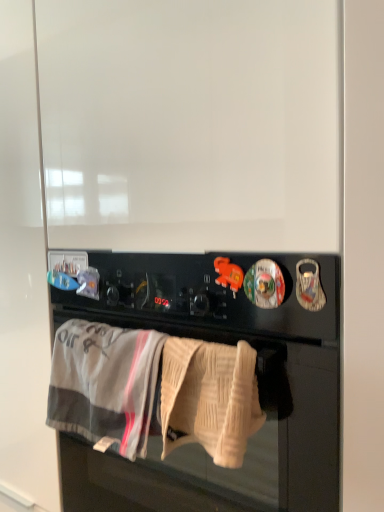
This screenshot has height=512, width=384. What do you see at coordinates (255, 374) in the screenshot?
I see `black matte oven at center` at bounding box center [255, 374].

From the picture: What is the approximate height of gray cotton bath towel at lower center, which is the 2th bath towel from right to left?

8.87 inches.

Locate an element on the screen. black matte oven at center is located at coordinates (255, 374).

From their relative heights in the image, would you say gray cotton bath towel at lower center, which is the 2th bath towel from right to left, is taller or shorter than black matte oven at center?

Clearly, gray cotton bath towel at lower center, which is the 2th bath towel from right to left, is shorter compared to black matte oven at center.

Is gray cotton bath towel at lower center, positioned as the first bath towel in left-to-right order, positioned far away from black matte oven at center?

No, gray cotton bath towel at lower center, positioned as the first bath towel in left-to-right order, is not far from black matte oven at center.

Between point (114, 381) and point (328, 493), which one is positioned behind?

The point (114, 381) is farther.

From the image's perspective, is gray cotton bath towel at lower center, positioned as the first bath towel in left-to-right order, located above or below black matte oven at center?

From the image's perspective, gray cotton bath towel at lower center, positioned as the first bath towel in left-to-right order, appears above black matte oven at center.

Considering the positions of objects beige knitted towel at lower center, marked as the first bath towel in a right-to-left arrangement, and black matte oven at center in the image provided, who is more to the left, beige knitted towel at lower center, marked as the first bath towel in a right-to-left arrangement, or black matte oven at center?

beige knitted towel at lower center, marked as the first bath towel in a right-to-left arrangement, is more to the left.

Is beige knitted towel at lower center, which is the 2th bath towel from left to right, wider or thinner than black matte oven at center?

Clearly, beige knitted towel at lower center, which is the 2th bath towel from left to right, has less width compared to black matte oven at center.

Is beige knitted towel at lower center, marked as the first bath towel in a right-to-left arrangement, aimed at black matte oven at center?

No, beige knitted towel at lower center, marked as the first bath towel in a right-to-left arrangement, is not aimed at black matte oven at center.

Which object is positioned more to the left, black matte oven at center or beige knitted towel at lower center, marked as the first bath towel in a right-to-left arrangement?

From the viewer's perspective, beige knitted towel at lower center, marked as the first bath towel in a right-to-left arrangement, appears more on the left side.

From their relative heights in the image, would you say black matte oven at center is taller or shorter than beige knitted towel at lower center, which is the 2th bath towel from left to right?

Considering their sizes, black matte oven at center has more height than beige knitted towel at lower center, which is the 2th bath towel from left to right.

You are a GUI agent. You are given a task and a screenshot of the screen. Output one action in this format:
    pyautogui.click(x=<x>, y=<y>)
    Task: Click on the 1st bath towel behind the black matte oven at center
    This screenshot has width=384, height=512.
    Given the screenshot: What is the action you would take?
    pyautogui.click(x=209, y=398)

Is point (157, 330) closer or farther from the camera than point (233, 387)?

Point (157, 330).

Is beige knitted towel at lower center, which is the 2th bath towel from left to right, bigger than gray cotton bath towel at lower center, which is the 2th bath towel from right to left?

Actually, beige knitted towel at lower center, which is the 2th bath towel from left to right, might be smaller than gray cotton bath towel at lower center, which is the 2th bath towel from right to left.

Considering the positions of point (221, 370) and point (133, 423), is point (221, 370) closer or farther from the camera than point (133, 423)?

Point (221, 370) is positioned closer to the camera compared to point (133, 423).

Does beige knitted towel at lower center, which is the 2th bath towel from left to right, have a lesser height compared to gray cotton bath towel at lower center, which is the 2th bath towel from right to left?

Correct, beige knitted towel at lower center, which is the 2th bath towel from left to right, is not as tall as gray cotton bath towel at lower center, which is the 2th bath towel from right to left.

Is beige knitted towel at lower center, marked as the first bath towel in a right-to-left arrangement, turned away from gray cotton bath towel at lower center, positioned as the first bath towel in left-to-right order?

beige knitted towel at lower center, marked as the first bath towel in a right-to-left arrangement, does not have its back to gray cotton bath towel at lower center, positioned as the first bath towel in left-to-right order.

Can you confirm if gray cotton bath towel at lower center, positioned as the first bath towel in left-to-right order, is shorter than beige knitted towel at lower center, marked as the first bath towel in a right-to-left arrangement?

No.

Is gray cotton bath towel at lower center, which is the 2th bath towel from right to left, next to beige knitted towel at lower center, marked as the first bath towel in a right-to-left arrangement, and touching it?

No.

Is gray cotton bath towel at lower center, which is the 2th bath towel from right to left, inside or outside of beige knitted towel at lower center, which is the 2th bath towel from left to right?

The correct answer is: outside.

From a real-world perspective, which bath towel is the 1st one above the black matte oven at center? Please provide its 2D coordinates.

[(104, 384)]

Considering the relative sizes of black matte oven at center and gray cotton bath towel at lower center, which is the 2th bath towel from right to left, in the image provided, is black matte oven at center wider than gray cotton bath towel at lower center, which is the 2th bath towel from right to left,?

Correct, the width of black matte oven at center exceeds that of gray cotton bath towel at lower center, which is the 2th bath towel from right to left.

Could you tell me if black matte oven at center is turned towards gray cotton bath towel at lower center, positioned as the first bath towel in left-to-right order?

Yes, black matte oven at center is turned towards gray cotton bath towel at lower center, positioned as the first bath towel in left-to-right order.

The height and width of the screenshot is (512, 384). What are the coordinates of `the 2nd bath towel to the left of the black matte oven at center, counting from the anchor's position` in the screenshot? It's located at 104,384.

From a real-world perspective, which bath towel is the 2nd one above the black matte oven at center? Please provide its 2D coordinates.

[(209, 398)]

Based on their spatial positions, is beige knitted towel at lower center, which is the 2th bath towel from left to right, or gray cotton bath towel at lower center, which is the 2th bath towel from right to left, further from black matte oven at center?

gray cotton bath towel at lower center, which is the 2th bath towel from right to left, lies further to black matte oven at center than the other object.

From the image, which object appears to be farther from gray cotton bath towel at lower center, which is the 2th bath towel from right to left, black matte oven at center or beige knitted towel at lower center, marked as the first bath towel in a right-to-left arrangement?

Based on the image, black matte oven at center appears to be further to gray cotton bath towel at lower center, which is the 2th bath towel from right to left.

Based on their spatial positions, is gray cotton bath towel at lower center, positioned as the first bath towel in left-to-right order, or black matte oven at center closer to beige knitted towel at lower center, marked as the first bath towel in a right-to-left arrangement?

gray cotton bath towel at lower center, positioned as the first bath towel in left-to-right order, lies closer to beige knitted towel at lower center, marked as the first bath towel in a right-to-left arrangement, than the other object.

From the image, which object appears to be farther from gray cotton bath towel at lower center, positioned as the first bath towel in left-to-right order, beige knitted towel at lower center, marked as the first bath towel in a right-to-left arrangement, or black matte oven at center?

black matte oven at center.

Which object lies further to the anchor point black matte oven at center, gray cotton bath towel at lower center, which is the 2th bath towel from right to left, or beige knitted towel at lower center, marked as the first bath towel in a right-to-left arrangement?

gray cotton bath towel at lower center, which is the 2th bath towel from right to left, lies further to black matte oven at center than the other object.

Based on their spatial positions, is black matte oven at center or gray cotton bath towel at lower center, which is the 2th bath towel from right to left, further from beige knitted towel at lower center, which is the 2th bath towel from left to right?

black matte oven at center is further to beige knitted towel at lower center, which is the 2th bath towel from left to right.

At what (x,y) coordinates should I click in order to perform the action: click on bath towel situated between gray cotton bath towel at lower center, which is the 2th bath towel from right to left, and black matte oven at center from left to right. Please return your answer as a coordinate pair (x, y). Looking at the image, I should click on (209, 398).